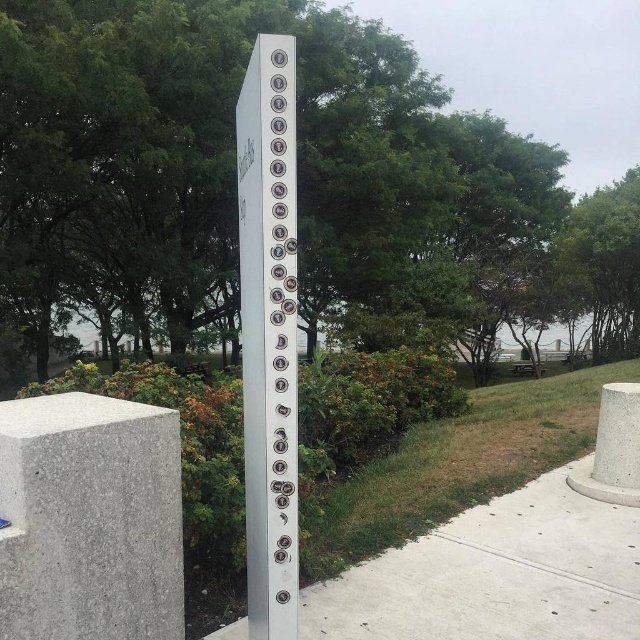
Question: Does gray concrete at lower left have a greater width compared to gray concrete pavement at center?

Choices:
 (A) no
 (B) yes

Answer: (A)

Question: Which point is closer to the camera?

Choices:
 (A) (52, 609)
 (B) (268, 474)

Answer: (B)

Question: Which point is farther to the camera?

Choices:
 (A) (451, 582)
 (B) (172, 636)
 (C) (284, 337)

Answer: (A)

Question: Where is gray concrete pavement at center located in relation to silver metallic pole at center in the image?

Choices:
 (A) left
 (B) right

Answer: (B)

Question: In this image, where is gray concrete at lower left located relative to silver metallic pole at center?

Choices:
 (A) above
 (B) below

Answer: (B)

Question: Based on their relative distances, which object is farther from the silver metallic pole at center?

Choices:
 (A) gray concrete pavement at center
 (B) gray concrete at lower left

Answer: (A)